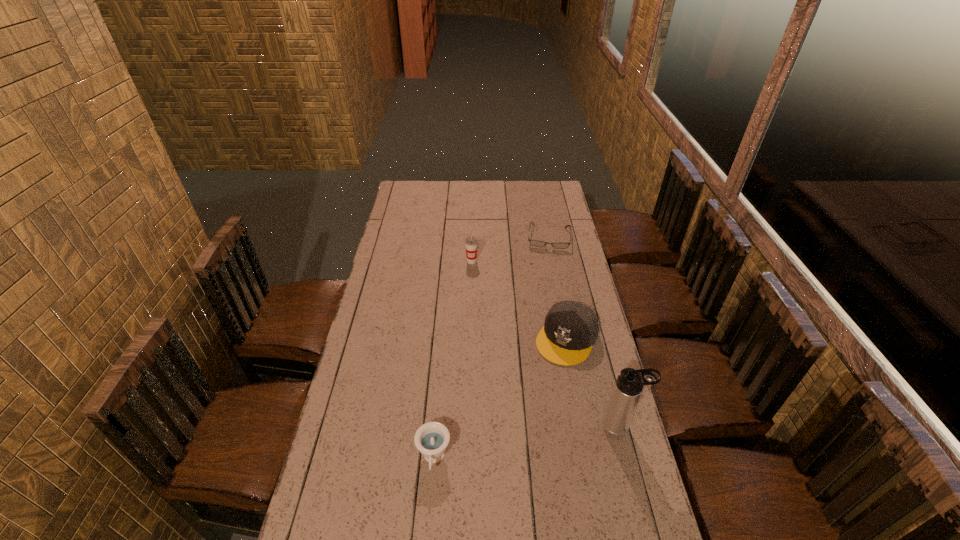
Locate an element on the screen. teacup is located at coordinates (431, 439).

At what (x,y) coordinates should I click in order to perform the action: click on the leftmost object. Please return your answer as a coordinate pair (x, y). Image resolution: width=960 pixels, height=540 pixels. Looking at the image, I should click on (431, 439).

This screenshot has height=540, width=960. Find the location of `thermos bottle`. thermos bottle is located at coordinates (629, 385).

Locate an element on the screen. This screenshot has width=960, height=540. the third shortest object is located at coordinates [x=571, y=328].

At what (x,y) coordinates should I click in order to perform the action: click on the third farthest object. Please return your answer as a coordinate pair (x, y). The image size is (960, 540). Looking at the image, I should click on (571, 328).

Locate an element on the screen. The image size is (960, 540). the farthest object is located at coordinates (535, 243).

Identify the location of the shortest object. (535, 243).

In order to click on cup in this screenshot , I will do `click(471, 243)`.

Identify the location of the fourth nearest object. (471, 243).

Locate an element on the screen. free spot located 0.050m on the front-facing side of the cap is located at coordinates (549, 373).